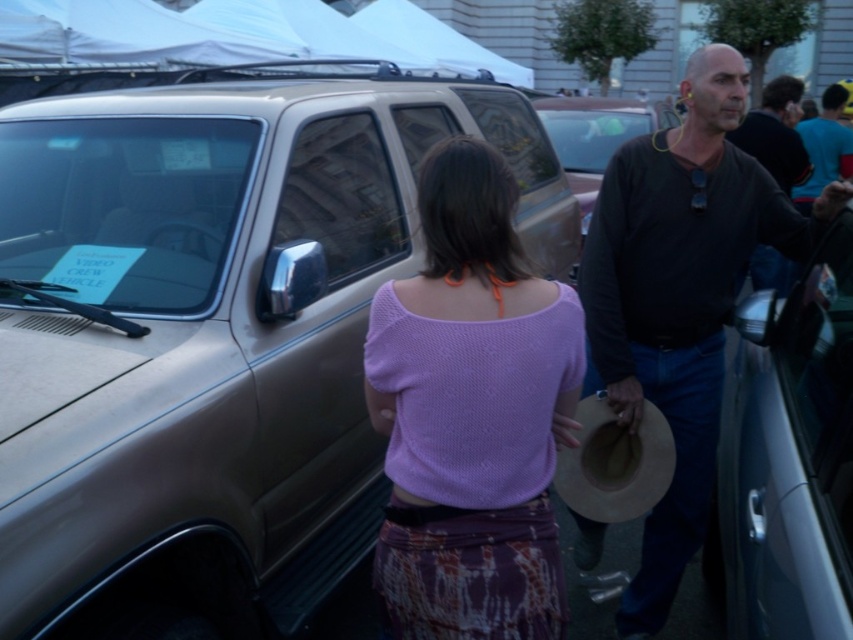
Is purple knit top at center in front of metallic silver car door at right?

That is False.

Is purple knit top at center shorter than metallic silver car door at right?

Correct, purple knit top at center is not as tall as metallic silver car door at right.

Who is more distant from viewer, (461, 257) or (830, 563)?

The point (461, 257) is more distant.

In order to click on purple knit top at center in this screenshot , I will do `click(471, 413)`.

Is point (445, 221) positioned behind point (636, 144)?

No, (445, 221) is in front of (636, 144).

The image size is (853, 640). What do you see at coordinates (471, 413) in the screenshot?
I see `purple knit top at center` at bounding box center [471, 413].

Does point (463, 532) come closer to viewer compared to point (706, 506)?

Yes, it is.

The width and height of the screenshot is (853, 640). What are the coordinates of `purple knit top at center` in the screenshot? It's located at (471, 413).

Is black matte shirt at center shorter than metallic silver car door at right?

No, black matte shirt at center is not shorter than metallic silver car door at right.

The image size is (853, 640). What do you see at coordinates (680, 296) in the screenshot? I see `black matte shirt at center` at bounding box center [680, 296].

Where is `black matte shirt at center`? The width and height of the screenshot is (853, 640). black matte shirt at center is located at coordinates (680, 296).